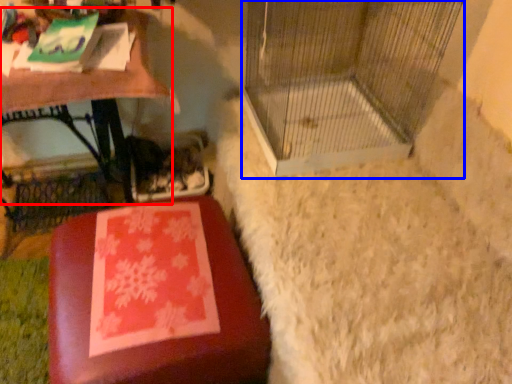
Question: Which point is closer to the camera, table (highlighted by a red box) or bird cage (highlighted by a blue box)?

Choices:
 (A) table
 (B) bird cage

Answer: (B)